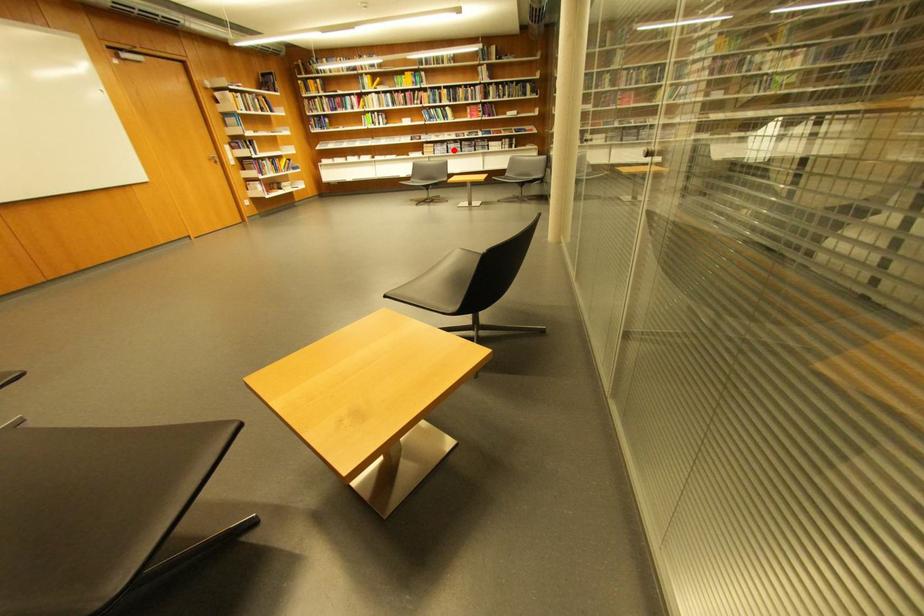
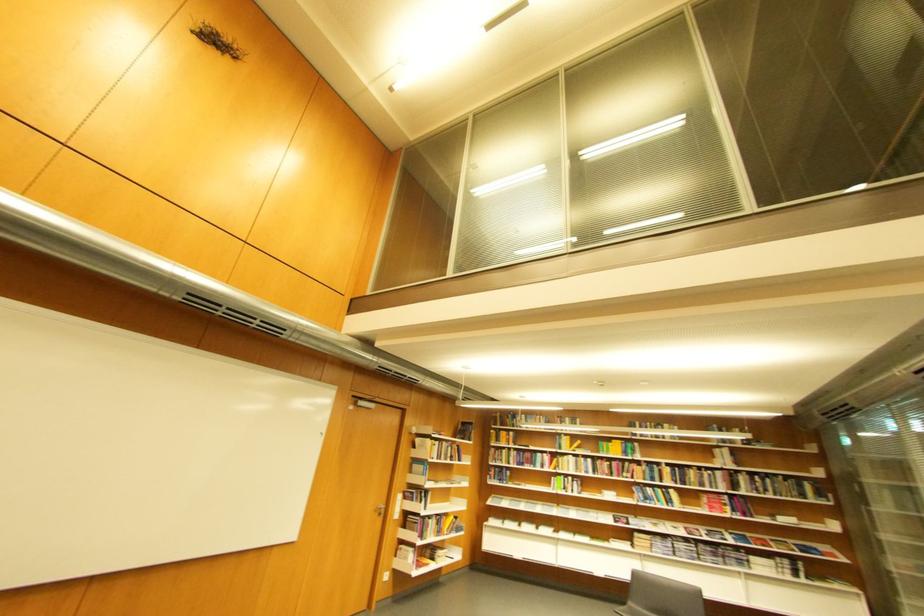
Question: I am providing you with two images of the same scene from different viewpoints. A red point is shown in image1. For the corresponding object point in image2, is it positioned nearer or farther from the camera?

Choices:
 (A) Nearer
 (B) Farther

Answer: (B)